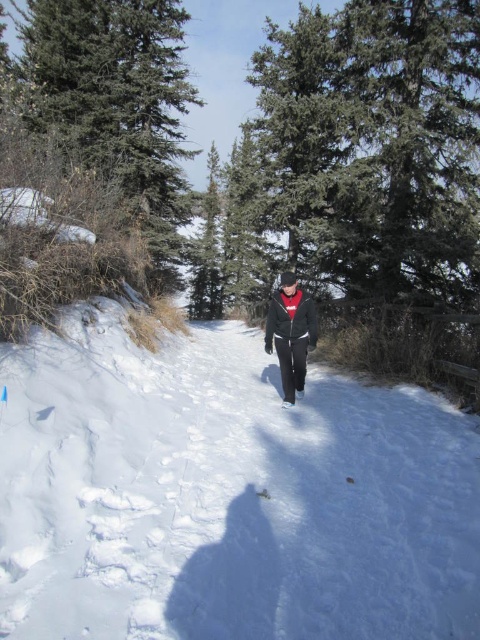
Describe the element at coordinates (226, 493) in the screenshot. I see `white fluffy snow at center` at that location.

Who is shorter, white fluffy snow at center or black matte jacket at center?

white fluffy snow at center

Which is behind, point (459, 476) or point (295, 273)?

The point (295, 273) is more distant.

Image resolution: width=480 pixels, height=640 pixels. Find the location of `white fluffy snow at center`. white fluffy snow at center is located at coordinates (226, 493).

Can you confirm if green matte tree at upper left is positioned to the left of black matte jacket at center?

Correct, you'll find green matte tree at upper left to the left of black matte jacket at center.

Where is `green matte tree at upper left`? green matte tree at upper left is located at coordinates [x=118, y=106].

Is point (63, 60) closer to viewer compared to point (309, 321)?

No.

Locate an element on the screen. This screenshot has height=640, width=480. green matte tree at upper left is located at coordinates (118, 106).

Is white fluffy snow at center above green matte tree at upper left?

No, white fluffy snow at center is not above green matte tree at upper left.

How distant is white fluffy snow at center from green matte tree at upper left?

white fluffy snow at center and green matte tree at upper left are 25.77 meters apart from each other.

Does point (105, 516) come in front of point (55, 106)?

Yes, point (105, 516) is closer to viewer.

Where is `white fluffy snow at center`? The image size is (480, 640). white fluffy snow at center is located at coordinates (226, 493).